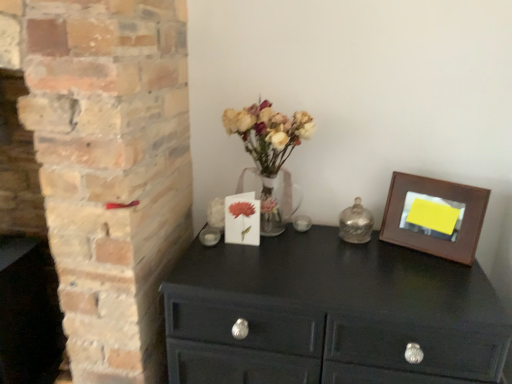
Question: Can you see matte black chest of drawers at center touching brown wooden picture frame at upper right?

Choices:
 (A) no
 (B) yes

Answer: (A)

Question: Is matte black chest of drawers at center facing away from brown wooden picture frame at upper right?

Choices:
 (A) yes
 (B) no

Answer: (B)

Question: Is matte black chest of drawers at center to the left of brown wooden picture frame at upper right from the viewer's perspective?

Choices:
 (A) yes
 (B) no

Answer: (A)

Question: Is matte black chest of drawers at center shorter than brown wooden picture frame at upper right?

Choices:
 (A) no
 (B) yes

Answer: (A)

Question: Could brown wooden picture frame at upper right be considered to be inside matte black chest of drawers at center?

Choices:
 (A) no
 (B) yes

Answer: (A)

Question: Does matte black chest of drawers at center have a greater width compared to brown wooden picture frame at upper right?

Choices:
 (A) no
 (B) yes

Answer: (B)

Question: Is translucent glass vase at center facing towards brown wooden picture frame at upper right?

Choices:
 (A) yes
 (B) no

Answer: (B)

Question: Is translucent glass vase at center positioned with its back to brown wooden picture frame at upper right?

Choices:
 (A) no
 (B) yes

Answer: (A)

Question: Is translucent glass vase at center further to the viewer compared to brown wooden picture frame at upper right?

Choices:
 (A) yes
 (B) no

Answer: (B)

Question: Can you confirm if translucent glass vase at center is thinner than brown wooden picture frame at upper right?

Choices:
 (A) no
 (B) yes

Answer: (A)

Question: From a real-world perspective, is translucent glass vase at center positioned under brown wooden picture frame at upper right based on gravity?

Choices:
 (A) no
 (B) yes

Answer: (A)

Question: Is translucent glass vase at center shorter than brown wooden picture frame at upper right?

Choices:
 (A) no
 (B) yes

Answer: (A)

Question: Is matte black chest of drawers at center oriented away from shiny metallic bell at center-right?

Choices:
 (A) yes
 (B) no

Answer: (B)